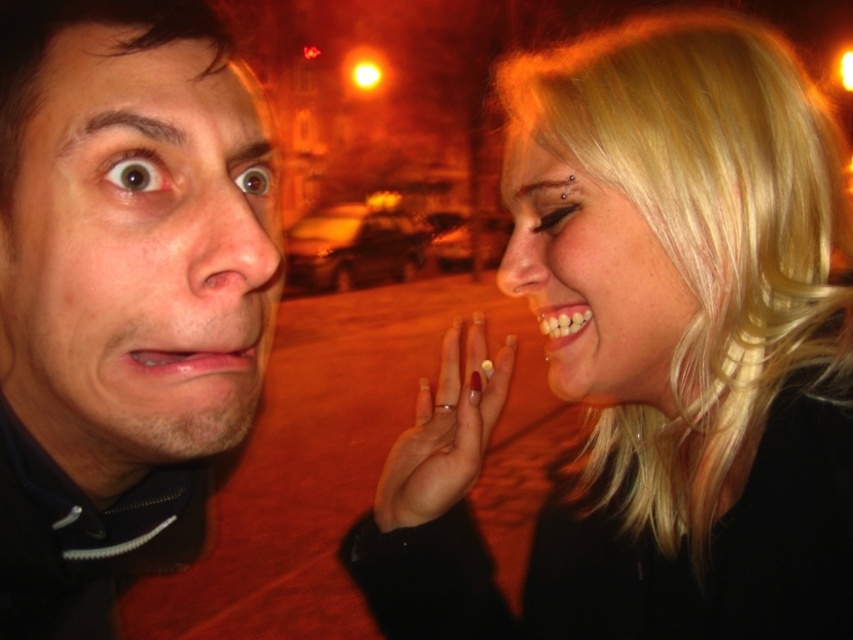
Question: Is blonde hair at upper right to the right of white matte ring at center from the viewer's perspective?

Choices:
 (A) no
 (B) yes

Answer: (B)

Question: Based on their relative distances, which object is farther from the smooth skin face at left?

Choices:
 (A) matte skin nose at center
 (B) white matte ring at center

Answer: (B)

Question: Among these objects, which one is farthest from the camera?

Choices:
 (A) blonde hair at upper right
 (B) smooth skin nose at center

Answer: (B)

Question: Does smooth skin face at left appear under smooth skin nose at center?

Choices:
 (A) no
 (B) yes

Answer: (B)

Question: Which point is farther from the camera taking this photo?

Choices:
 (A) (627, 282)
 (B) (529, 260)
 (C) (473, 474)
 (D) (254, 292)

Answer: (C)

Question: From the image, what is the correct spatial relationship of blonde hair at upper right in relation to smooth skin nose at center?

Choices:
 (A) below
 (B) above

Answer: (A)